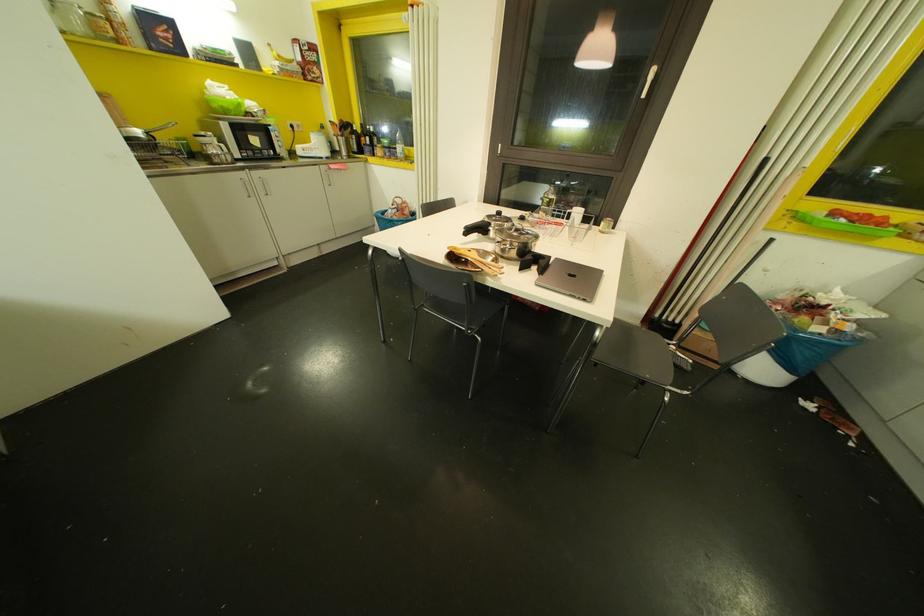
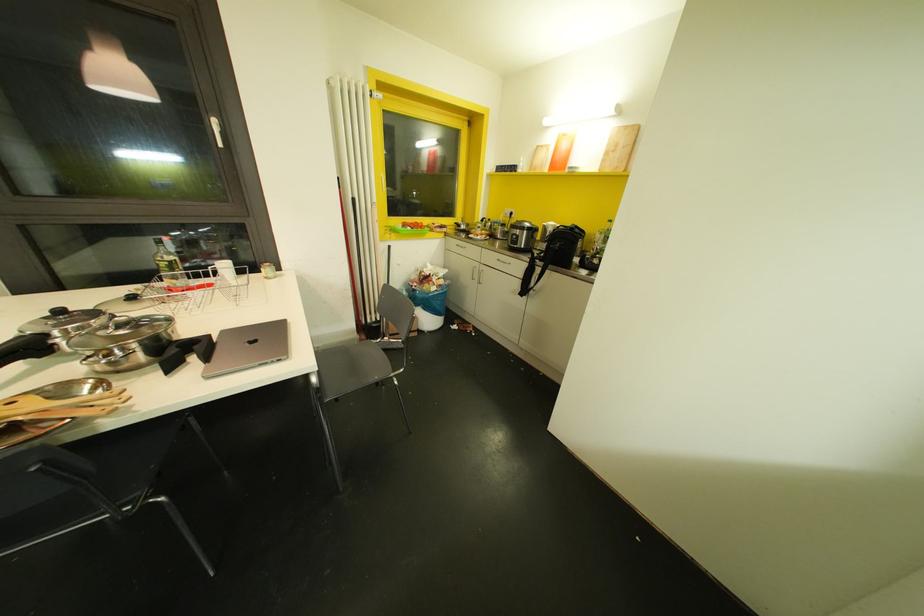
Locate, in the second image, the point that corresponds to (x=485, y=270) in the first image.

(82, 413)